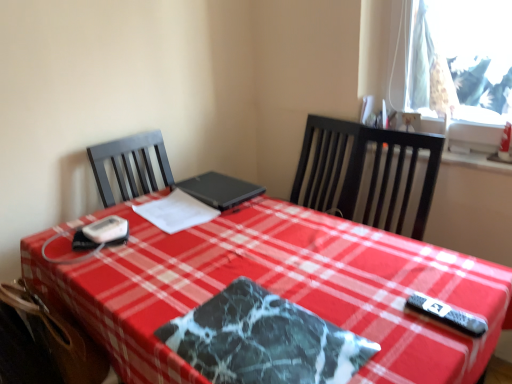
Locate an element on the screen. vacant area on top of marble-patterned placemat at center (from a real-world perspective) is located at coordinates (259, 328).